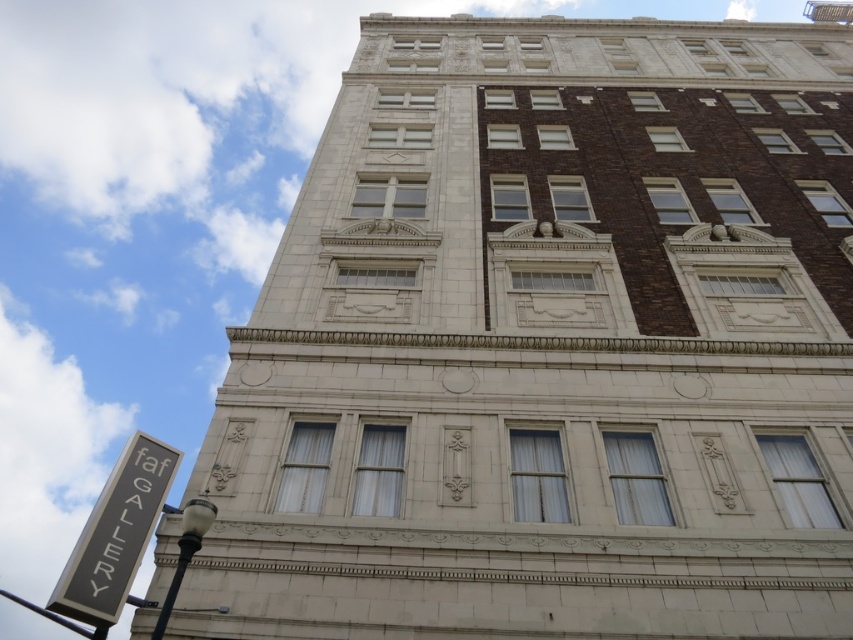
You are standing on the sidewalk in front of the building and want to take a photo that includes both the point at coordinates point (111,476) and the point at coordinates point (99,630). Which point should you focus on first to ensure both are in the frame?

You should focus on point (111,476) first because it is closer to you than point (99,630), which is further away. This way, you can adjust your camera to include both points in the frame.

You are a delivery person trying to find the entrance to the faf GALLERY. You see the black metal sign at lower left and the black metal pole at lower left. Which object is positioned higher up relative to the other?

The black metal sign at lower left is above the black metal pole at lower left, so it is positioned higher up.

You are a pedestrian walking along the sidewalk and see the black metal sign at lower left and the black metal pole at lower left. Which object is closer to you?

The black metal sign at lower left is closer to you because the black metal pole at lower left is behind it.